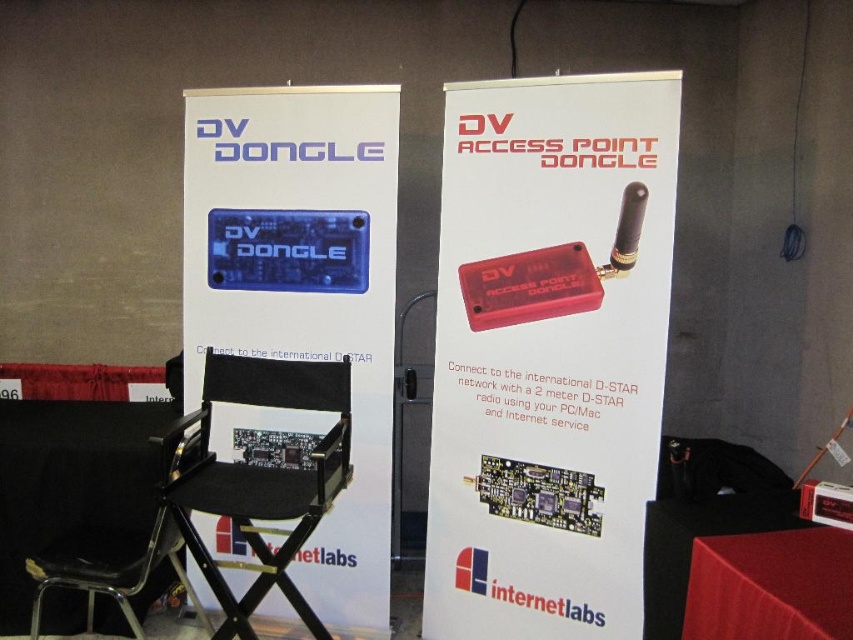
Question: Which object is closer to the camera taking this photo?

Choices:
 (A) red plastic dongle at center
 (B) blue plastic dv dongle at center
 (C) black fabric folding chair at center

Answer: (C)

Question: Does red plastic dongle at center come in front of black fabric folding chair at center?

Choices:
 (A) no
 (B) yes

Answer: (A)

Question: Does red plastic dongle at center appear over blue plastic dv dongle at center?

Choices:
 (A) yes
 (B) no

Answer: (B)

Question: Can you confirm if blue plastic dv dongle at center is positioned to the right of black fabric folding chair at center?

Choices:
 (A) yes
 (B) no

Answer: (A)

Question: Which point is closer to the camera?

Choices:
 (A) blue plastic dv dongle at center
 (B) black fabric chair at center
 (C) black fabric folding chair at center
 (D) red plastic dongle at center

Answer: (B)

Question: Which point appears closest to the camera in this image?

Choices:
 (A) (212, 324)
 (B) (677, 116)
 (C) (181, 422)
 (D) (230, 355)

Answer: (B)